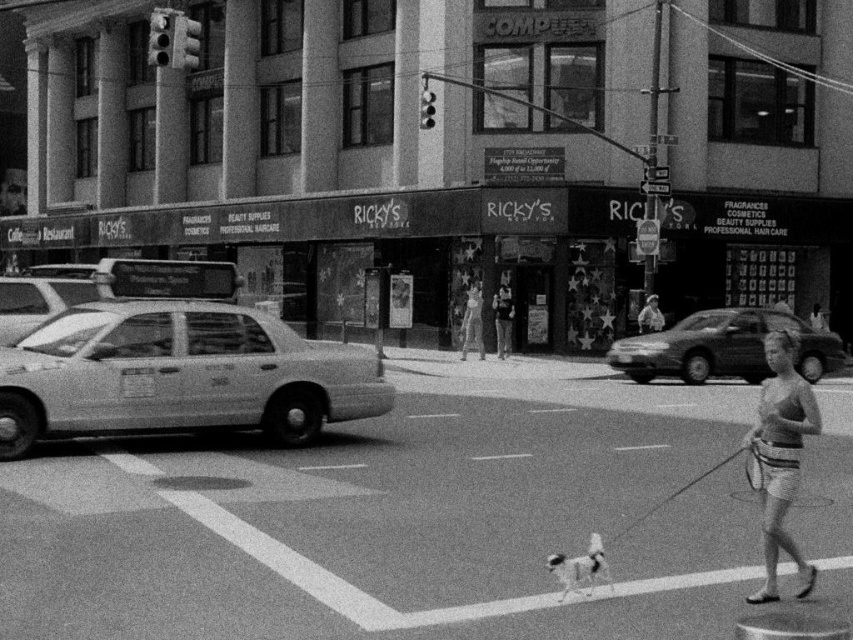
Does matte white taxi at left have a lesser width compared to smooth skin person at center?

Indeed, matte white taxi at left has a lesser width compared to smooth skin person at center.

Is matte white taxi at left below smooth skin person at center?

A: Yes.

Which is behind, point (131, 392) or point (474, 312)?

Positioned behind is point (474, 312).

Identify the location of matte white taxi at left. (178, 376).

Is matte white taxi at left wider than striped fabric shorts at lower right?

In fact, matte white taxi at left might be narrower than striped fabric shorts at lower right.

In the scene shown: Which of these two, matte white taxi at left or striped fabric shorts at lower right, stands taller?

With more height is striped fabric shorts at lower right.

Who is more forward, (108, 417) or (801, 444)?

Point (801, 444) is in front.

Where is `matte white taxi at left`? matte white taxi at left is located at coordinates (178, 376).

Does white fur dog at center appear under smooth skin person at center?

Yes.

Does point (572, 577) come in front of point (465, 317)?

Yes, it is in front of point (465, 317).

Is point (575, 563) positioned before point (466, 339)?

Yes, it is in front of point (466, 339).

At what (x,y) coordinates should I click in order to perform the action: click on white fur dog at center. Please return your answer as a coordinate pair (x, y). Looking at the image, I should click on (579, 566).